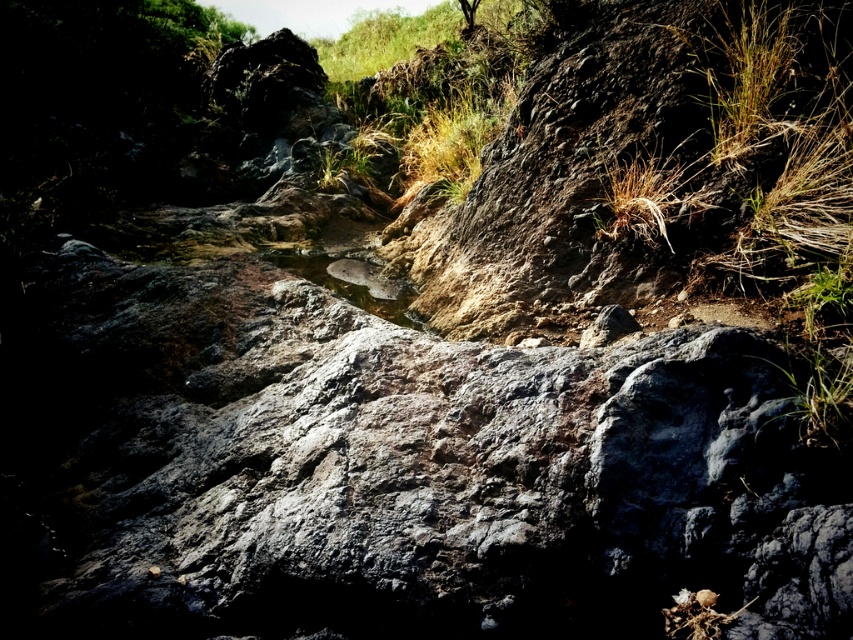
Describe the element at coordinates (451, 140) in the screenshot. The image size is (853, 640). I see `dry grass at upper center` at that location.

Does dry grass at upper center have a greater width compared to greenish reflective water at center?

No.

Who is more distant from viewer, (405, 186) or (364, 298)?

Positioned behind is point (405, 186).

Identify the location of dry grass at upper center. The image size is (853, 640). (451, 140).